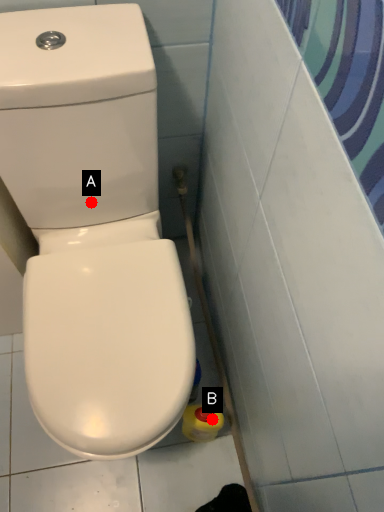
Question: Two points are circled on the image, labeled by A and B beside each circle. Which point is closer to the camera taking this photo?

Choices:
 (A) A is closer
 (B) B is closer

Answer: (A)